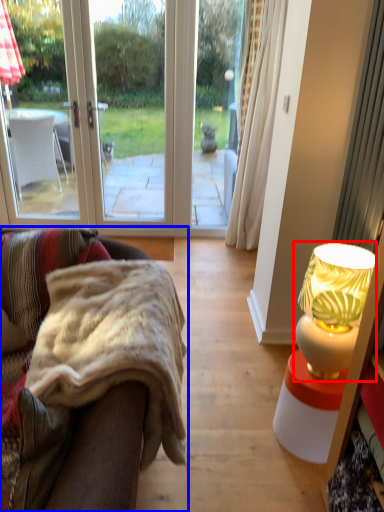
Question: Which object is further to the camera taking this photo, lamp (highlighted by a red box) or studio couch (highlighted by a blue box)?

Choices:
 (A) lamp
 (B) studio couch

Answer: (A)